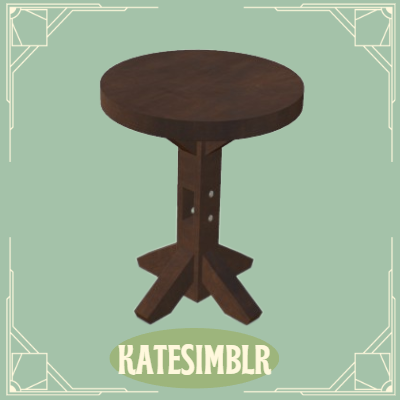
This screenshot has width=400, height=400. Identify the location of table legs. (167, 286), (233, 293).